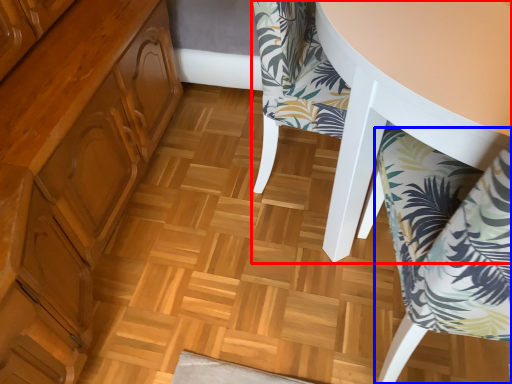
Question: Which of the following is the farthest to the observer, chair (highlighted by a red box) or chair (highlighted by a blue box)?

Choices:
 (A) chair
 (B) chair

Answer: (A)